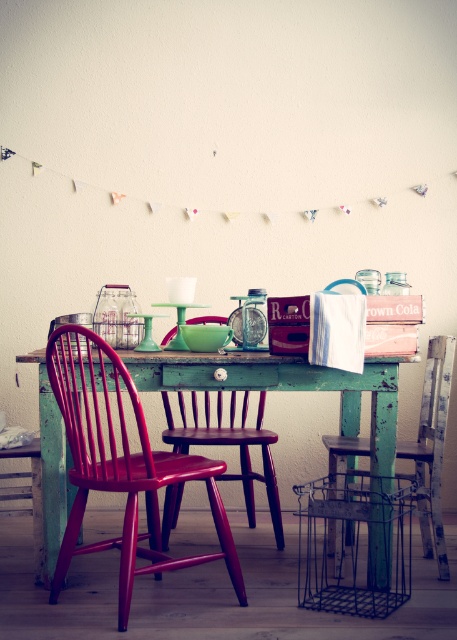
Question: Which of the following is the closest to the observer?

Choices:
 (A) (248, 356)
 (B) (79, 410)
 (C) (425, 365)

Answer: (B)

Question: Observing the image, what is the correct spatial positioning of matte red chair at center in reference to green wood chair at center?

Choices:
 (A) above
 (B) below

Answer: (B)

Question: Is green distressed wood table at center thinner than green wood chair at center?

Choices:
 (A) no
 (B) yes

Answer: (A)

Question: Can you confirm if green distressed wood table at center is bigger than green wood chair at center?

Choices:
 (A) yes
 (B) no

Answer: (B)

Question: Which object is closer to the camera taking this photo?

Choices:
 (A) green distressed wood table at center
 (B) green wood chair at center
 (C) metallic wire basket at center
 (D) matte red chair at center

Answer: (D)

Question: Among these objects, which one is nearest to the camera?

Choices:
 (A) metallic wire basket at center
 (B) wooden chair at center

Answer: (A)